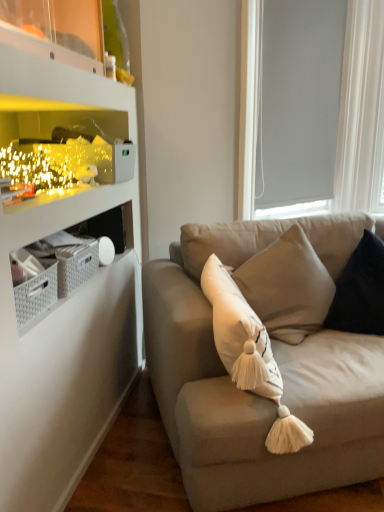
Question: Is dark blue velvet pillow at right further to camera compared to white matte window screen at upper right?

Choices:
 (A) no
 (B) yes

Answer: (A)

Question: From the image's perspective, does dark blue velvet pillow at right appear lower than white matte window screen at upper right?

Choices:
 (A) no
 (B) yes

Answer: (B)

Question: Is white matte window screen at upper right inside dark blue velvet pillow at right?

Choices:
 (A) no
 (B) yes

Answer: (A)

Question: Is dark blue velvet pillow at right facing towards white matte window screen at upper right?

Choices:
 (A) no
 (B) yes

Answer: (A)

Question: Are dark blue velvet pillow at right and white matte window screen at upper right making contact?

Choices:
 (A) no
 (B) yes

Answer: (A)

Question: Is dark blue velvet pillow at right oriented away from white matte window screen at upper right?

Choices:
 (A) yes
 (B) no

Answer: (B)

Question: Is white matte window screen at upper right touching dark blue velvet pillow at right?

Choices:
 (A) yes
 (B) no

Answer: (B)

Question: Is white matte window screen at upper right further to camera compared to dark blue velvet pillow at right?

Choices:
 (A) no
 (B) yes

Answer: (B)

Question: Considering the relative positions of white matte window screen at upper right and dark blue velvet pillow at right in the image provided, is white matte window screen at upper right in front of dark blue velvet pillow at right?

Choices:
 (A) no
 (B) yes

Answer: (A)

Question: From a real-world perspective, is white matte window screen at upper right positioned over dark blue velvet pillow at right based on gravity?

Choices:
 (A) no
 (B) yes

Answer: (B)

Question: Does white matte window screen at upper right appear on the right side of dark blue velvet pillow at right?

Choices:
 (A) yes
 (B) no

Answer: (B)

Question: Can you confirm if white matte window screen at upper right is thinner than dark blue velvet pillow at right?

Choices:
 (A) yes
 (B) no

Answer: (A)

Question: Is suede beige couch at center oriented away from dark blue velvet pillow at right?

Choices:
 (A) no
 (B) yes

Answer: (B)